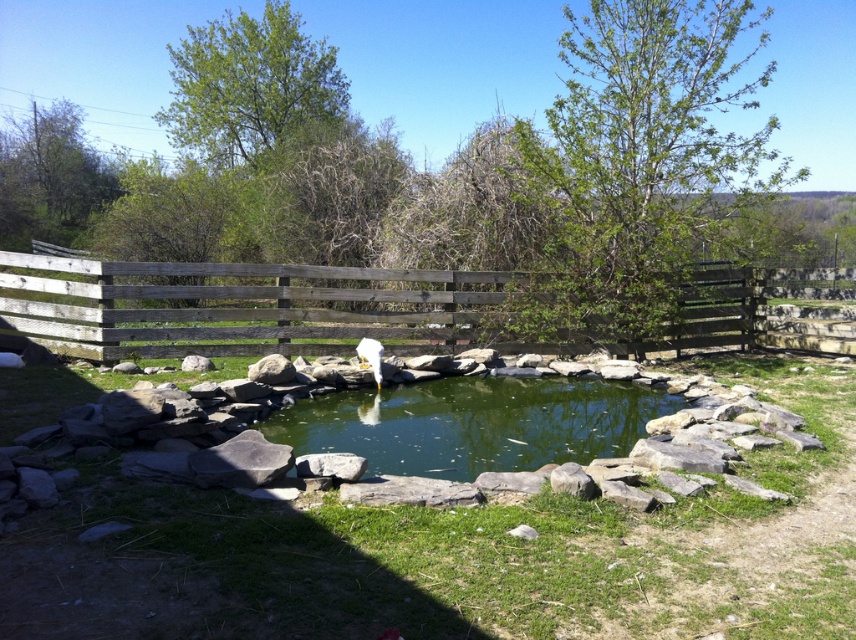
Consider the image. You are a birdwatcher observing the scene. You notice the green liquid water at center and the white fluffy bird at center. Which object is positioned higher in the image?

The green liquid water at center is taller than the white fluffy bird at center, so the water is positioned higher in the image.